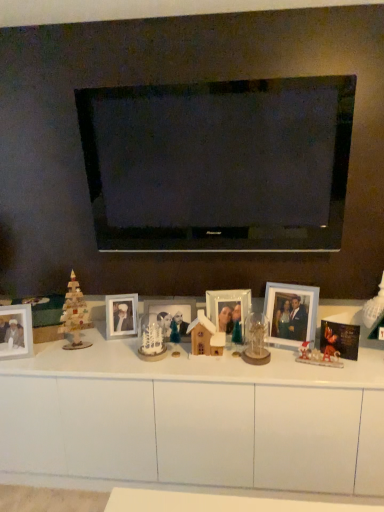
The height and width of the screenshot is (512, 384). Identify the location of free space to the left of white frosted glass christmas tree at center, which ranks as the 3th toy in right-to-left order. (111, 353).